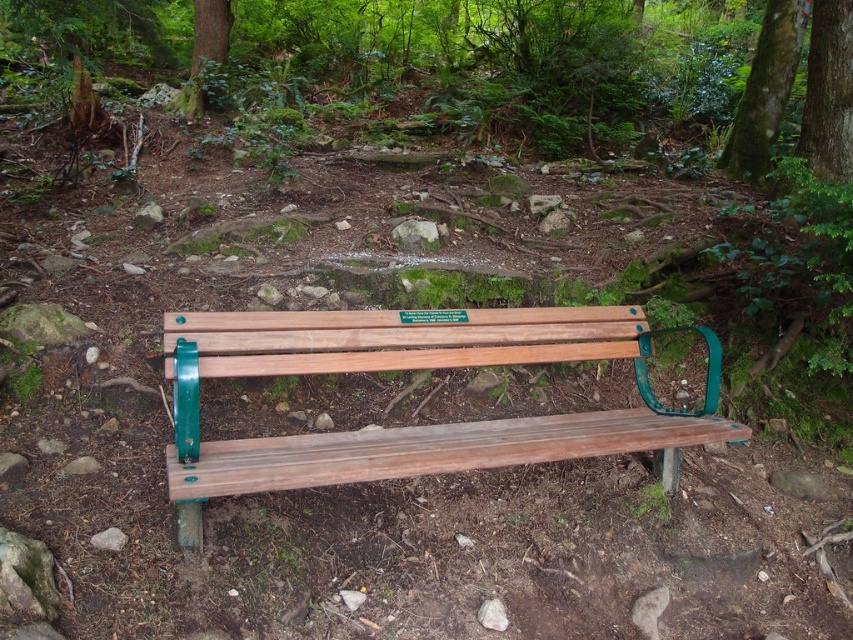
Who is shorter, wooden bench at center or green textured tree trunk at upper center?

wooden bench at center

Does wooden bench at center appear under green textured tree trunk at upper center?

Yes.

Measure the distance between wooden bench at center and camera.

wooden bench at center and camera are 1.36 meters apart from each other.

Image resolution: width=853 pixels, height=640 pixels. Identify the location of wooden bench at center. (409, 369).

Is green textured bark at upper right shorter than green textured tree trunk at upper right?

Yes, green textured bark at upper right is shorter than green textured tree trunk at upper right.

Is green textured bark at upper right smaller than green textured tree trunk at upper right?

Yes, green textured bark at upper right is smaller than green textured tree trunk at upper right.

You are a GUI agent. You are given a task and a screenshot of the screen. Output one action in this format:
    pyautogui.click(x=<x>, y=<y>)
    Task: Click on the green textured bark at upper right
    
    Given the screenshot: What is the action you would take?
    pyautogui.click(x=828, y=92)

Who is shorter, green textured bark at upper right or green textured tree trunk at upper center?

With less height is green textured bark at upper right.

Can you confirm if green textured bark at upper right is positioned to the right of green textured tree trunk at upper center?

Yes, green textured bark at upper right is to the right of green textured tree trunk at upper center.

This screenshot has height=640, width=853. What are the coordinates of `green textured bark at upper right` in the screenshot? It's located at (828, 92).